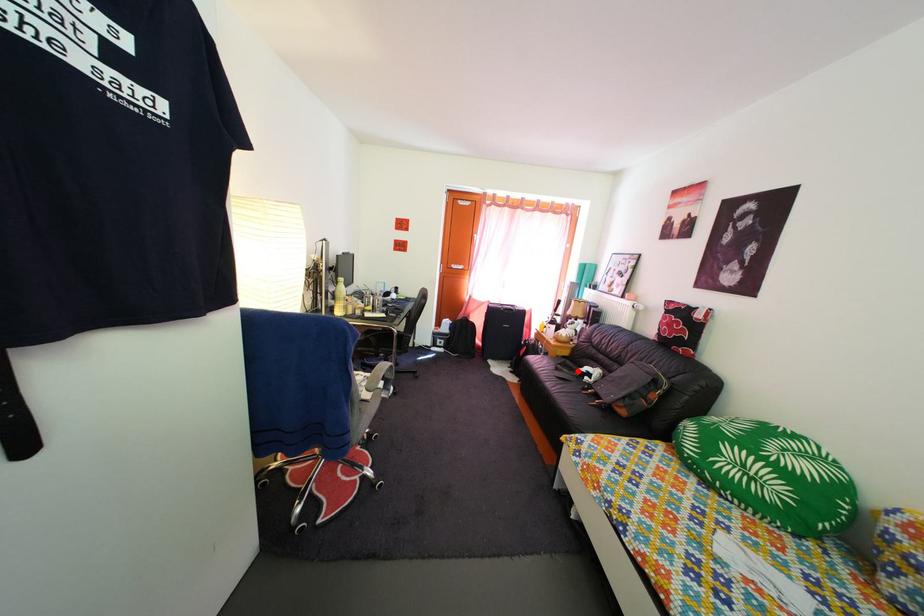
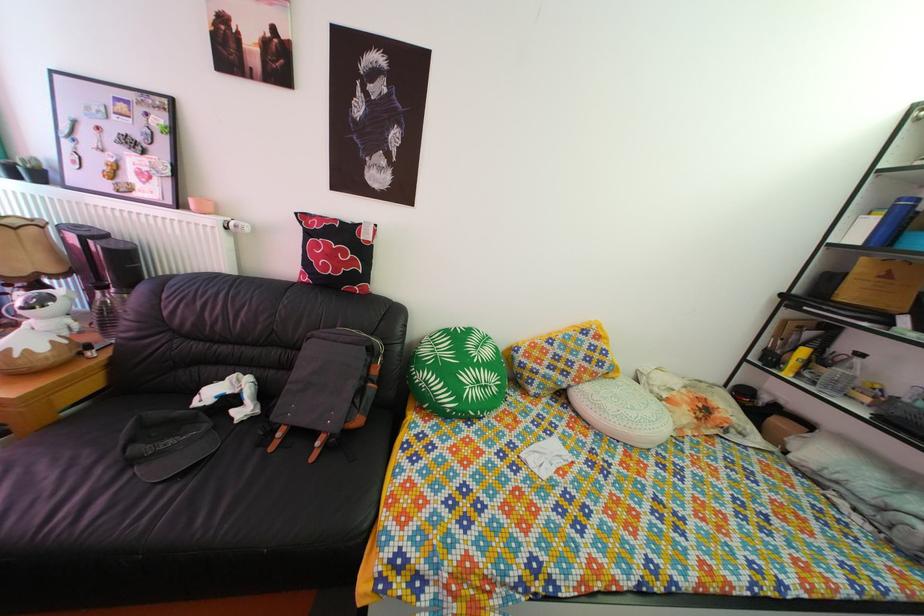
Question: I am providing you with two images of the same scene from different viewpoints. Image1 has a red point marked. In image2, the corresponding 3D location appears at what relative position? Reply with the corresponding letter.

Choices:
 (A) Closer
 (B) Farther

Answer: (B)